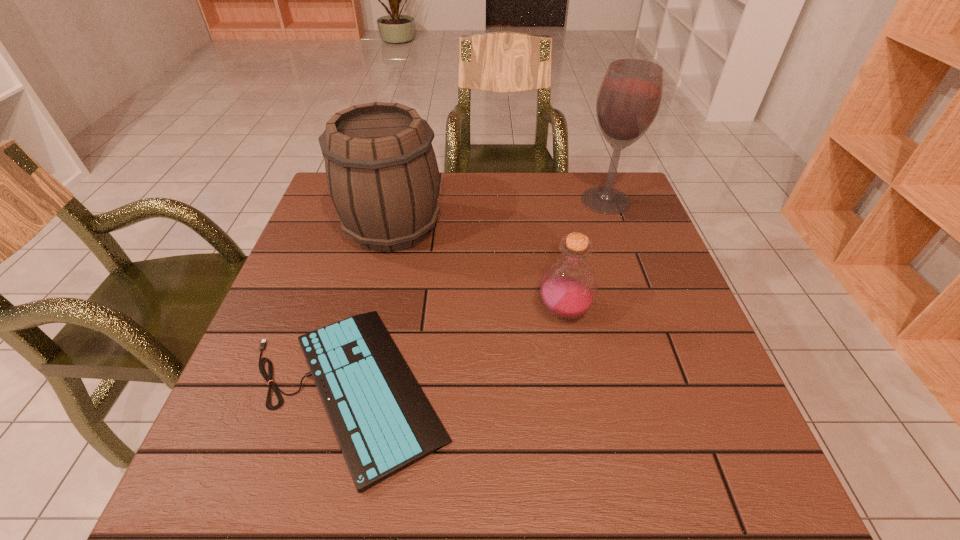
This screenshot has height=540, width=960. What are the coordinates of `the tallest object` in the screenshot? It's located at (630, 95).

The image size is (960, 540). Identify the location of alcohol. (630, 95).

Identify the location of wine bucket. (381, 169).

Identify the location of bottle. (568, 288).

In order to click on the second object from right to left in this screenshot , I will do `click(568, 288)`.

Identify the location of the shortest object. This screenshot has height=540, width=960. (383, 422).

Where is `free space located on the front of the tallest object`? free space located on the front of the tallest object is located at coordinates (633, 276).

I want to click on blank space located 0.250m on the front of the wine bucket, so click(x=365, y=343).

The height and width of the screenshot is (540, 960). Identify the location of vacant space located on the left of the bottle. (464, 312).

At what (x,y) coordinates should I click in order to perform the action: click on vacant space located 0.170m on the back of the computer keyboard. Please return your answer as a coordinate pair (x, y). The width and height of the screenshot is (960, 540). Looking at the image, I should click on (380, 260).